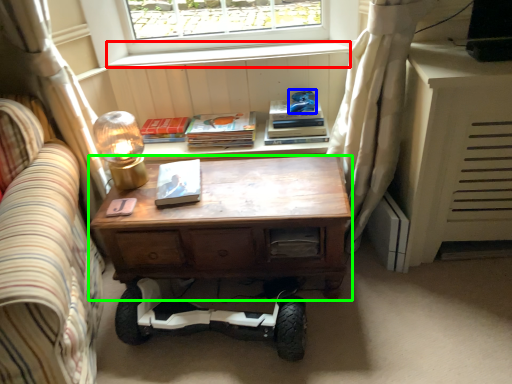
Question: Considering the real-world distances, which object is closest to window sill (highlighted by a red box)? toy (highlighted by a blue box) or desk (highlighted by a green box).

Choices:
 (A) toy
 (B) desk

Answer: (A)